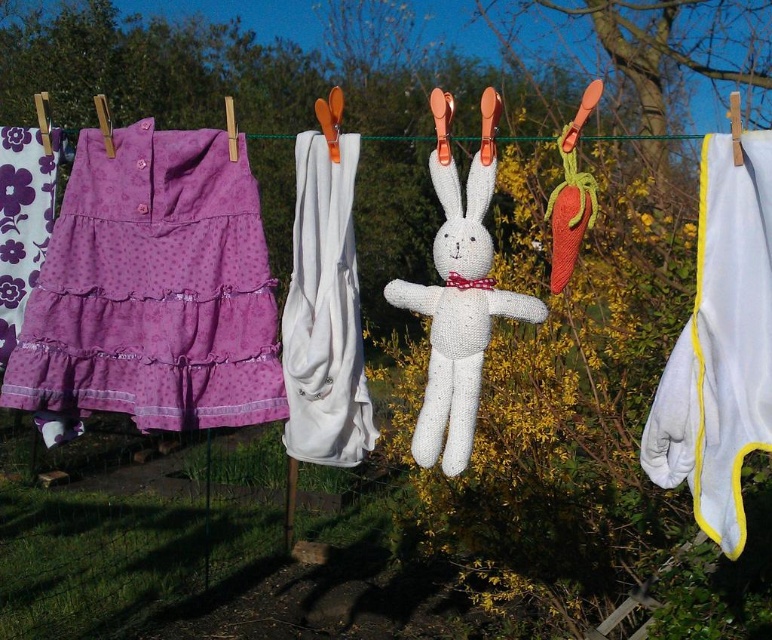
Question: Which is nearer to the purple polka dot fabric dress at left?

Choices:
 (A) white fabric at center
 (B) white knitted rabbit at center

Answer: (A)

Question: Observing the image, what is the correct spatial positioning of white cotton glove at right in reference to purple polka dot fabric at upper left?

Choices:
 (A) left
 (B) right

Answer: (B)

Question: Which object is farther from the camera taking this photo?

Choices:
 (A) purple polka dot fabric dress at left
 (B) white cotton glove at right
 (C) white knitted rabbit at center

Answer: (A)

Question: Among these points, which one is farthest from the camera?

Choices:
 (A) (310, 420)
 (B) (720, 388)

Answer: (A)

Question: Does white cotton glove at right have a smaller size compared to white fabric at center?

Choices:
 (A) no
 (B) yes

Answer: (A)

Question: From the image, what is the correct spatial relationship of purple polka dot fabric dress at left in relation to purple polka dot fabric at upper left?

Choices:
 (A) above
 (B) below

Answer: (B)